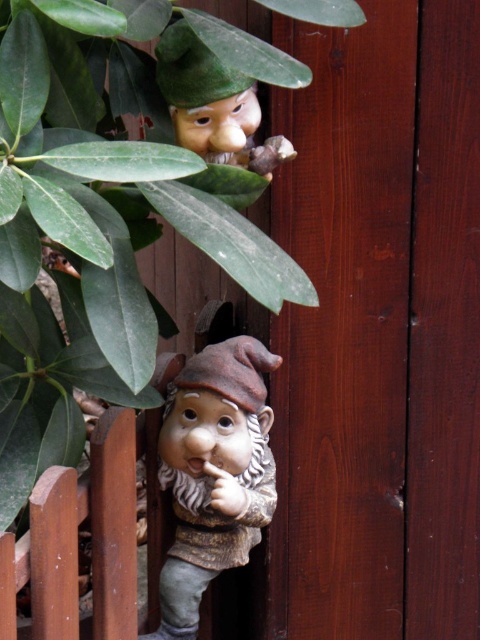
You are a visitor in a garden and see the matte brown statue at center and the matte green hat at upper center. Which object is located higher up in the image?

The matte green hat at upper center is located higher up in the image than the matte brown statue at center.

You are designing a garden layout and need to know the spatial relationship between the two statues. Which object is wider, the matte brown statue at center or the matte green hat at upper center?

The matte brown statue at center is wider than the matte green hat at upper center according to the description.

You are a curious child visiting a garden and see the matte brown statue at center and the matte green hat at upper center. Which one is taller?

The matte brown statue at center is much taller than the matte green hat at upper center.